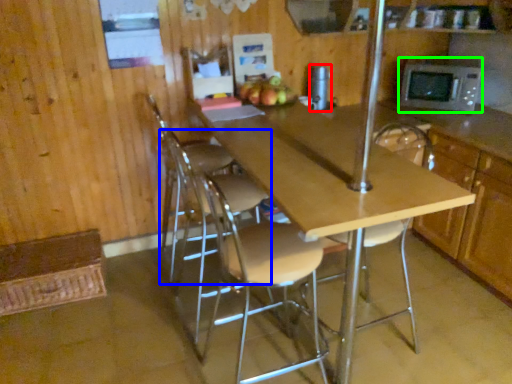
Question: Which object is positioned closest to appliance (highlighted by a red box)? Select from chair (highlighted by a blue box) and microwave oven (highlighted by a green box).

Choices:
 (A) chair
 (B) microwave oven

Answer: (B)